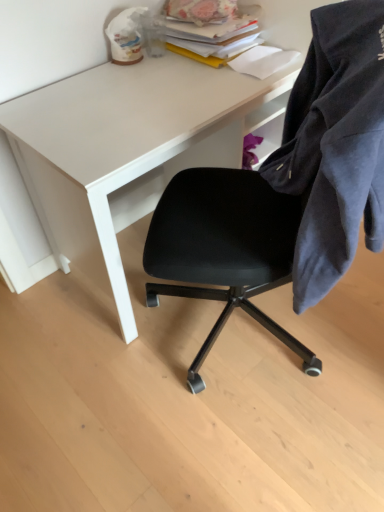
Locate an element on the screen. This screenshot has height=512, width=384. free space in front of white matte desk at upper center is located at coordinates (161, 422).